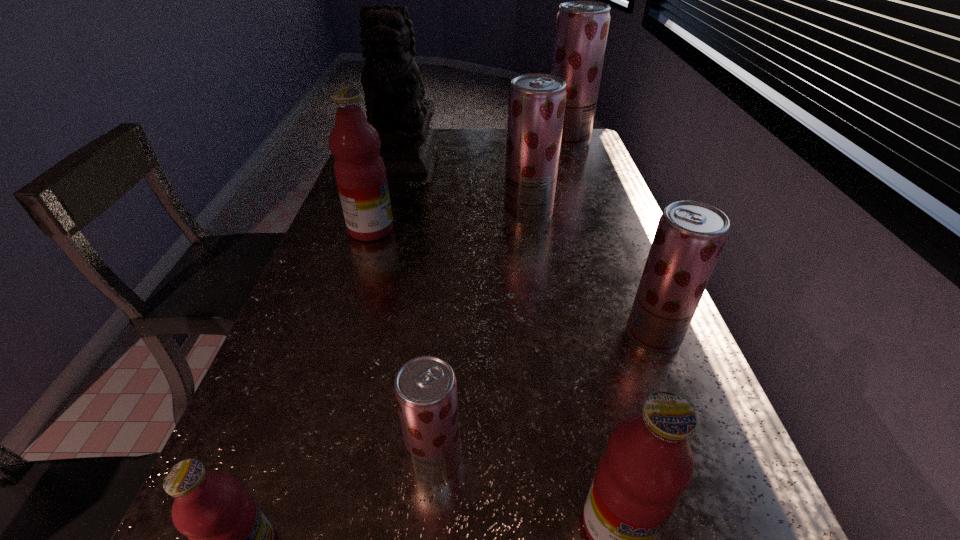
Locate an element on the screen. Image resolution: width=960 pixels, height=540 pixels. sculpture is located at coordinates (393, 88).

Image resolution: width=960 pixels, height=540 pixels. Find the location of `the farthest strawberry fruit juice`. the farthest strawberry fruit juice is located at coordinates (582, 27).

You are a GUI agent. You are given a task and a screenshot of the screen. Output one action in this format:
    pyautogui.click(x=<x>, y=<y>)
    Task: Click on the biggest strawberry fruit juice
    The image size is (960, 540).
    Given the screenshot: What is the action you would take?
    pyautogui.click(x=582, y=27)

Find the location of a particular element. This screenshot has width=960, height=540. the third smallest strawberry fruit juice is located at coordinates (536, 103).

Find the location of a particular element. This screenshot has width=960, height=540. the second farthest strawberry fruit juice is located at coordinates [x=536, y=103].

The height and width of the screenshot is (540, 960). In order to click on the biggest pink fruit juice in this screenshot , I will do `click(360, 173)`.

Find the location of a particular element. the fourth nearest object is located at coordinates tap(690, 235).

Image resolution: width=960 pixels, height=540 pixels. Identify the location of the fourth nearest fruit juice. (690, 235).

At what (x,y) coordinates should I click in order to perform the action: click on the nearest strawberry fruit juice. Please return your answer as a coordinate pair (x, y). The image size is (960, 540). Looking at the image, I should click on (425, 388).

You are a GUI agent. You are given a task and a screenshot of the screen. Output one action in this format:
    pyautogui.click(x=<x>, y=<y>)
    Task: Click on the third nearest fruit juice
    
    Given the screenshot: What is the action you would take?
    pyautogui.click(x=425, y=388)